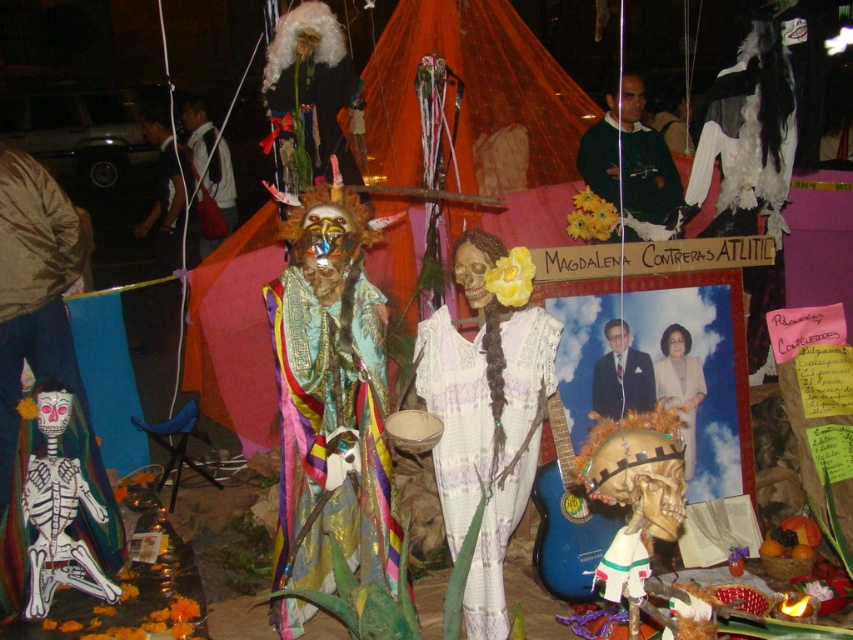
Does white lace dress at center have a greater height compared to matte gold mask at center?

Indeed, white lace dress at center has a greater height compared to matte gold mask at center.

What do you see at coordinates (485, 420) in the screenshot?
I see `white lace dress at center` at bounding box center [485, 420].

I want to click on white lace dress at center, so click(485, 420).

Does sweater at upper center have a greater height compared to white backpack at upper left?

No, sweater at upper center is not taller than white backpack at upper left.

Describe the element at coordinates (630, 156) in the screenshot. The width and height of the screenshot is (853, 640). I see `sweater at upper center` at that location.

The width and height of the screenshot is (853, 640). Describe the element at coordinates (630, 156) in the screenshot. I see `sweater at upper center` at that location.

Identify the location of sweater at upper center. (630, 156).

Is formal suit at center wider than matte gold mask at center?

Correct, the width of formal suit at center exceeds that of matte gold mask at center.

Can you confirm if formal suit at center is thinner than matte gold mask at center?

No, formal suit at center is not thinner than matte gold mask at center.

Based on the photo, measure the distance between point (592, 404) and camera.

Point (592, 404) is 3.80 meters from camera.

I want to click on formal suit at center, so click(x=621, y=376).